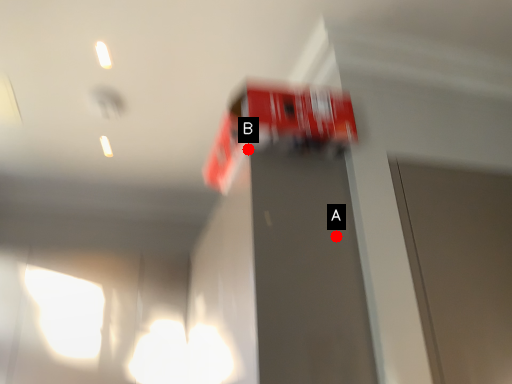
Question: Two points are circled on the image, labeled by A and B beside each circle. Which of the following is the closest to the observer?

Choices:
 (A) A is closer
 (B) B is closer

Answer: (A)